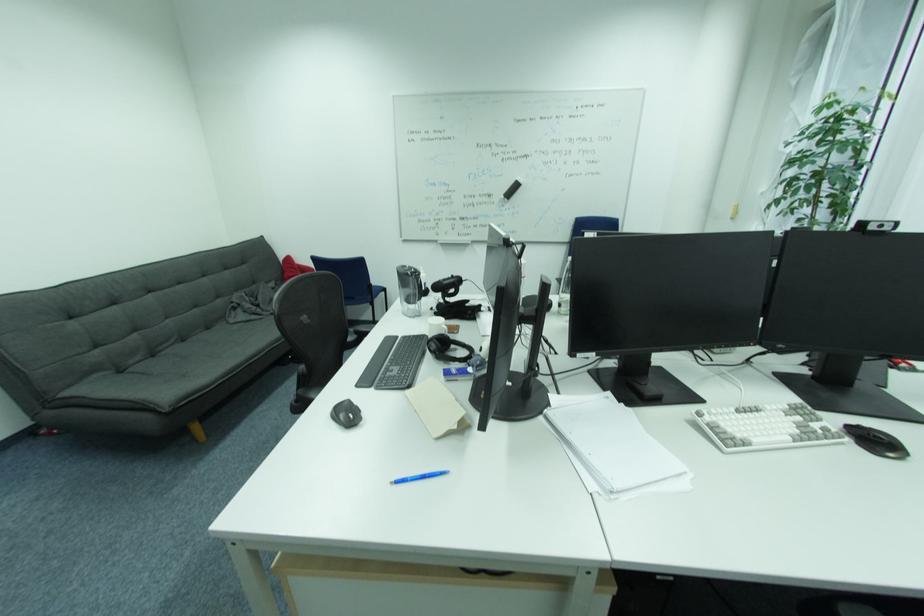
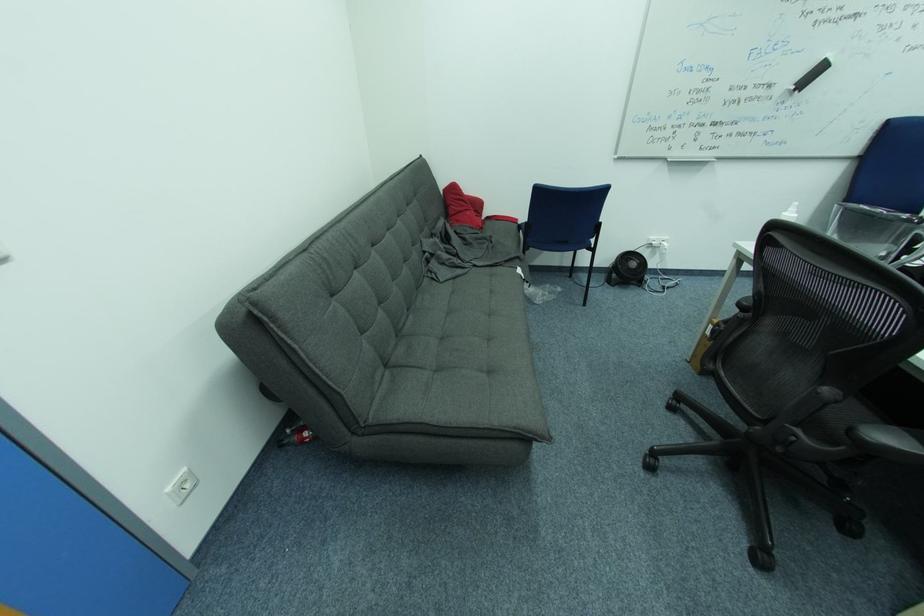
The point at (296, 260) is marked in the first image. Where is the corresponding point in the second image?

(459, 188)